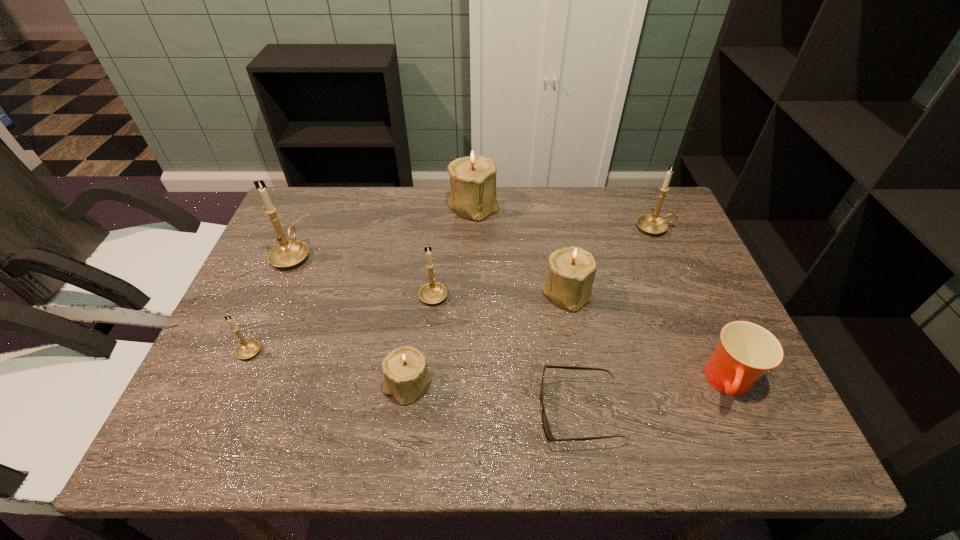
In order to click on the tallest candle_holder in this screenshot , I will do `click(288, 253)`.

Identify the location of the tallest object. (288, 253).

You are a GUI agent. You are given a task and a screenshot of the screen. Output one action in this format:
    pyautogui.click(x=<x>, y=<y>)
    Task: Click on the biggest beige candle_holder
    This screenshot has width=960, height=540.
    Given the screenshot: What is the action you would take?
    pyautogui.click(x=473, y=177)

Find the location of a particular element. This screenshot has height=540, width=960. the second beige candle_holder from left to right is located at coordinates (473, 177).

The image size is (960, 540). Identify the location of the rightmost candle_holder. 650,223.

The width and height of the screenshot is (960, 540). Identify the location of the rightmost gold candle holder. (650, 223).

The width and height of the screenshot is (960, 540). Identify the location of the second gold candle holder from right to left. (431, 293).

Where is `the second smallest gold candle holder`? the second smallest gold candle holder is located at coordinates (431, 293).

Locate an element on the screen. This screenshot has width=960, height=540. the second smallest beige candle_holder is located at coordinates (571, 273).

At what (x,y) coordinates should I click in order to perform the action: click on the second farthest beige candle_holder. Please return your answer as a coordinate pair (x, y). The height and width of the screenshot is (540, 960). Looking at the image, I should click on (571, 273).